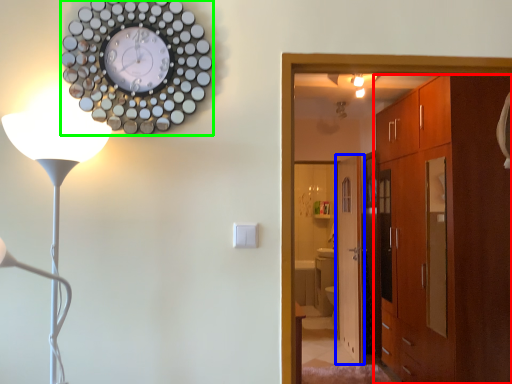
Question: Considering the real-world distances, which object is closest to cabinetry (highlighted by a red box)? door (highlighted by a blue box) or wall clock (highlighted by a green box).

Choices:
 (A) door
 (B) wall clock

Answer: (A)